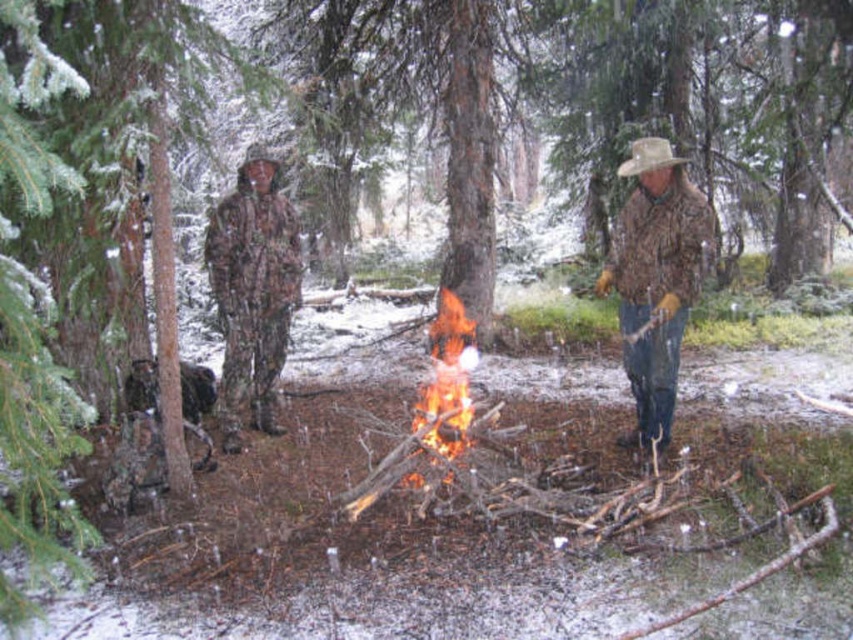
Question: Which point is closer to the camera taking this photo?

Choices:
 (A) (682, 168)
 (B) (444, 332)
 (C) (247, 356)

Answer: (A)

Question: Which object appears farthest from the camera in this image?

Choices:
 (A) camouflage jacket at center
 (B) flaming wood at center
 (C) camouflage fabric suit at center

Answer: (B)

Question: Is camouflage fabric suit at center to the left of flaming wood at center from the viewer's perspective?

Choices:
 (A) no
 (B) yes

Answer: (B)

Question: Estimate the real-world distances between objects in this image. Which object is closer to the flaming wood at center?

Choices:
 (A) camouflage fabric suit at center
 (B) camouflage jacket at center

Answer: (A)

Question: In this image, where is camouflage fabric suit at center located relative to flaming wood at center?

Choices:
 (A) right
 (B) left

Answer: (B)

Question: Can you confirm if camouflage jacket at center is bigger than flaming wood at center?

Choices:
 (A) yes
 (B) no

Answer: (A)